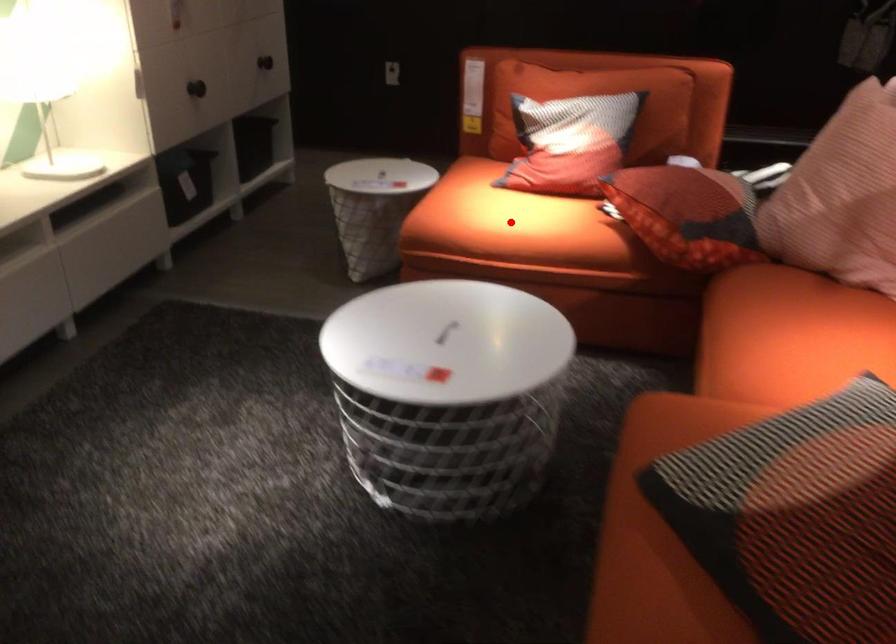
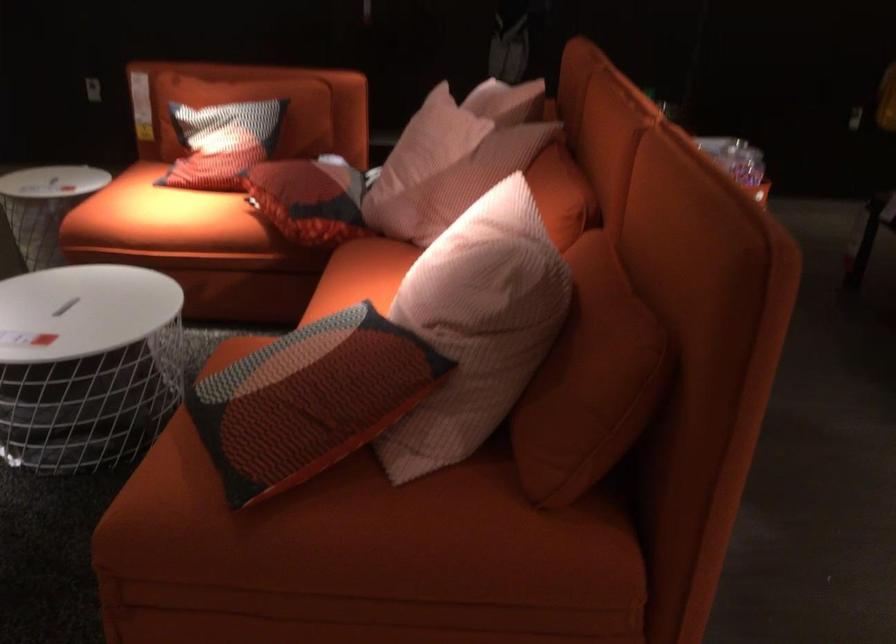
Find the pixel in the second image that matches the highlighted location in the first image.

(160, 216)